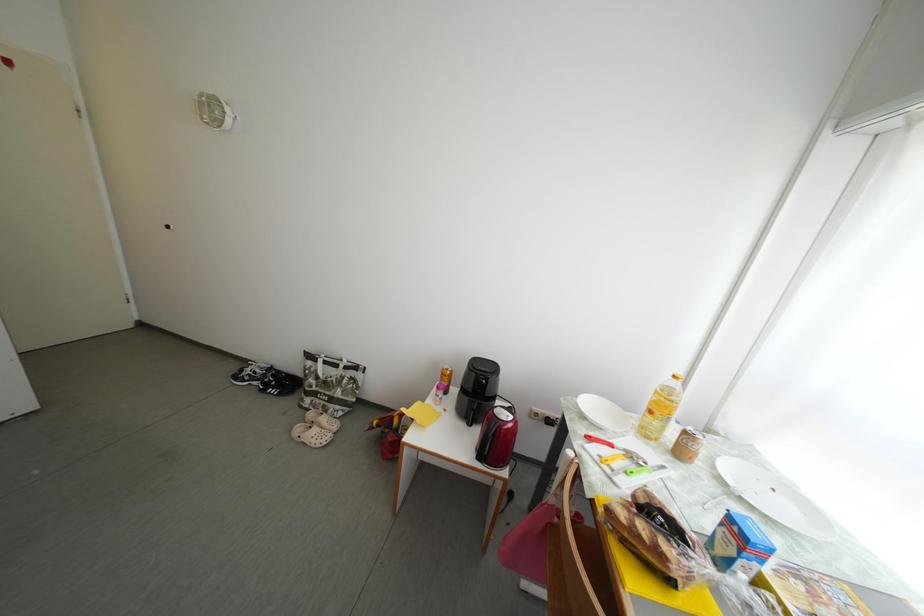
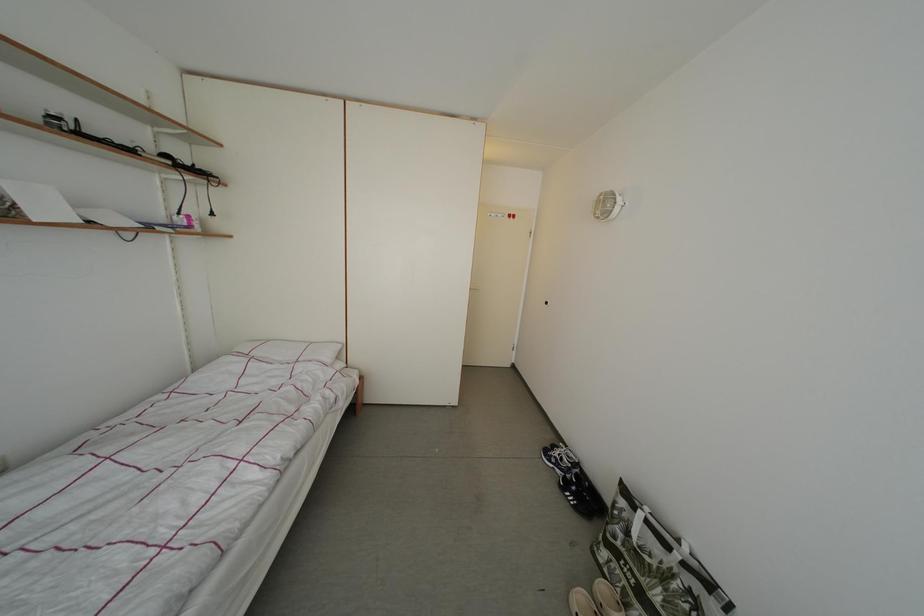
Question: The camera is either moving clockwise (left) or counter-clockwise (right) around the object. The first image is from the beginning of the video and the second image is from the end. Is the camera moving left or right when shooting the video?

Choices:
 (A) Left
 (B) Right

Answer: (B)